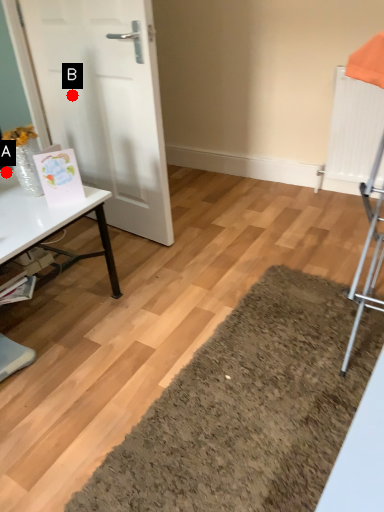
Question: Two points are circled on the image, labeled by A and B beside each circle. Which point appears closest to the camera in this image?

Choices:
 (A) A is closer
 (B) B is closer

Answer: (A)